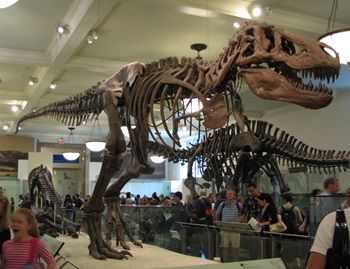
Where is `exit sign`? This screenshot has height=269, width=350. exit sign is located at coordinates (60, 140).